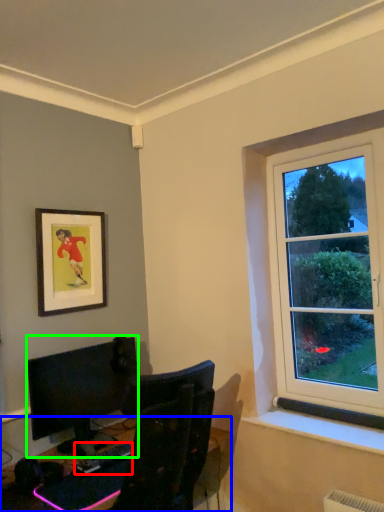
Question: Which object is the closest to the computer keyboard (highlighted by a red box)? Choose among these: desk (highlighted by a blue box) or computer monitor (highlighted by a green box).

Choices:
 (A) desk
 (B) computer monitor

Answer: (A)